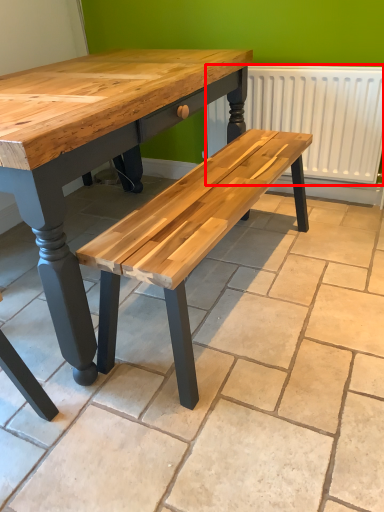
Question: From the image's perspective, where is radiator (annotated by the red box) located relative to tile?

Choices:
 (A) above
 (B) below

Answer: (A)